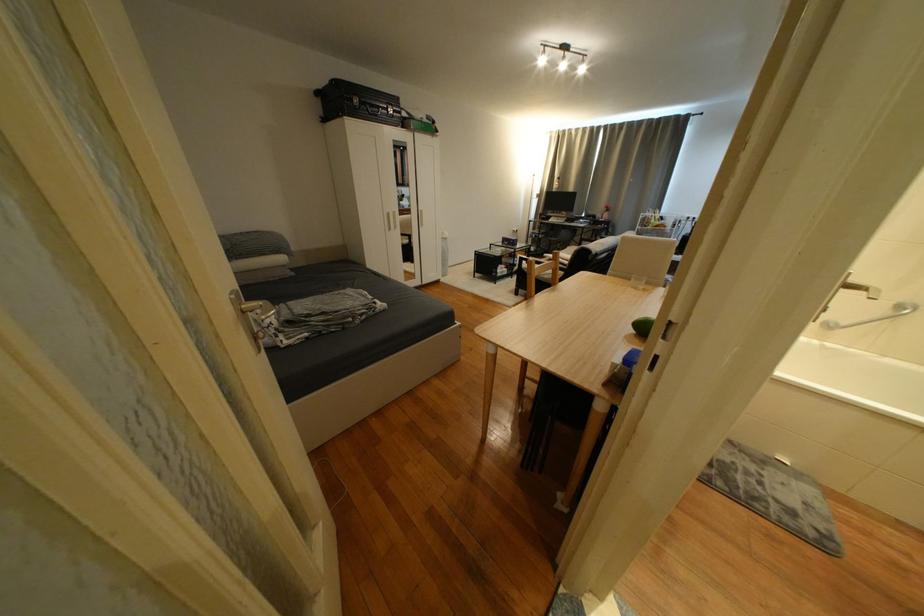
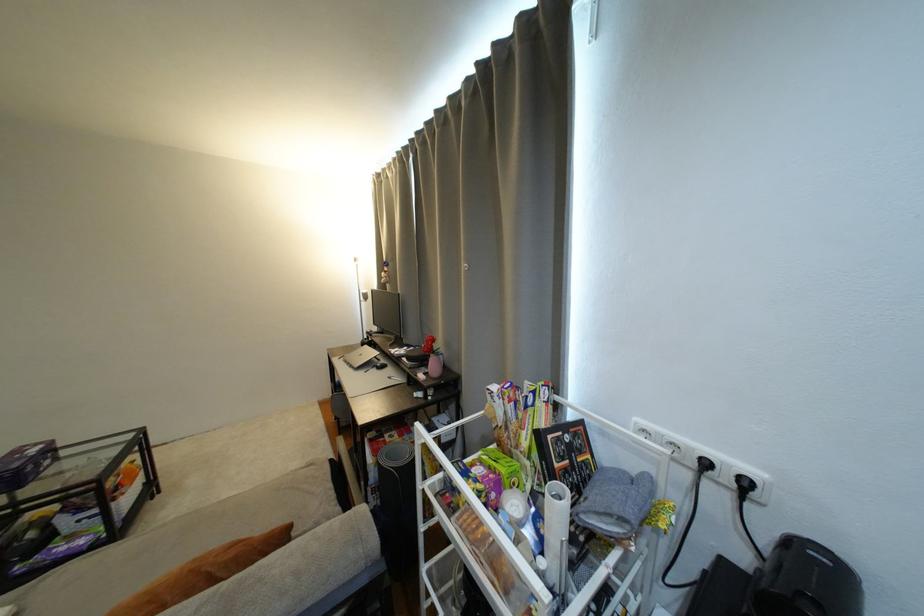
The point at (697, 219) is marked in the first image. Where is the corresponding point in the second image?

(714, 466)